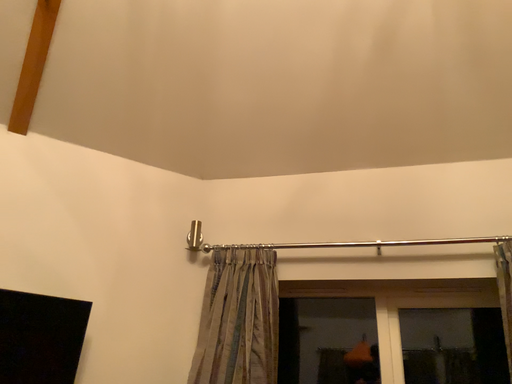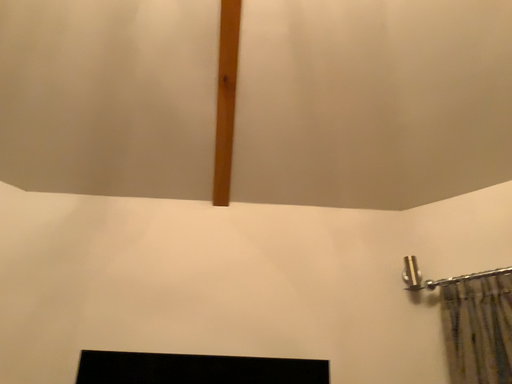
Question: Which way did the camera rotate in the video?

Choices:
 (A) rotated left
 (B) rotated right

Answer: (A)